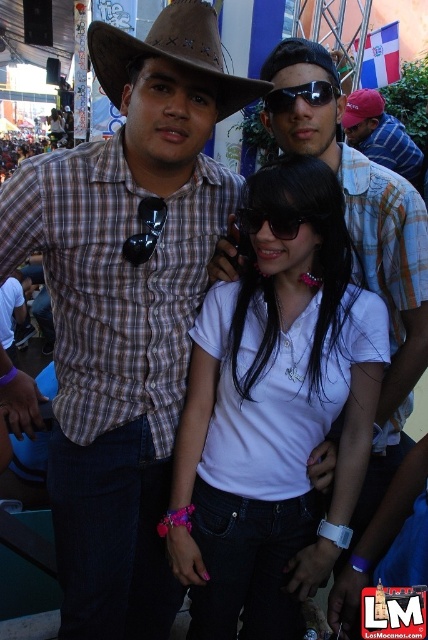
Who is taller, white matte shirt at center or red cotton cap at upper center?

white matte shirt at center

Does point (294, 349) lie behind point (348, 102)?

No, (294, 349) is closer to viewer.

This screenshot has height=640, width=428. In order to click on white matte shirt at center in this screenshot , I will do `click(273, 416)`.

Who is positioned more to the right, brown leather fedora at upper left or black plastic sunglasses at center?

black plastic sunglasses at center is more to the right.

Between brown leather fedora at upper left and black plastic sunglasses at center, which one is positioned lower?

black plastic sunglasses at center is lower down.

What do you see at coordinates (172, 52) in the screenshot?
I see `brown leather fedora at upper left` at bounding box center [172, 52].

Where is `brown leather fedora at upper left`? This screenshot has width=428, height=640. brown leather fedora at upper left is located at coordinates (172, 52).

Who is more forward, [177,240] or [350,116]?

Point [177,240]

Does point (119, 458) come farther from viewer compared to point (365, 115)?

No, it is not.

Between point (214, 209) and point (383, 99), which one is positioned in front?

Point (214, 209) is more forward.

Where is `brown plaid shirt at center`? Image resolution: width=428 pixels, height=640 pixels. brown plaid shirt at center is located at coordinates (125, 307).